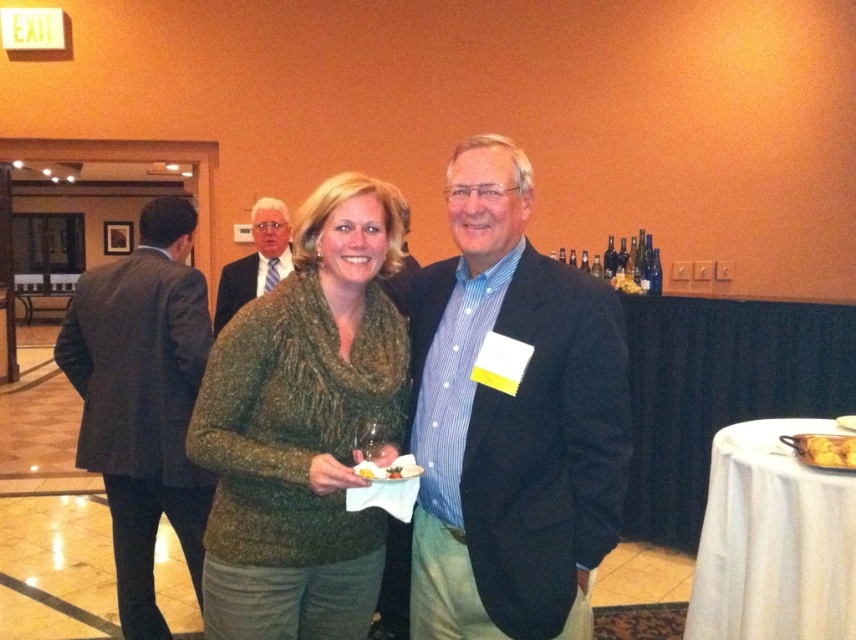
Which is in front, point (140, 230) or point (805, 456)?

Point (805, 456) is more forward.

Where is `dark gray suit at left`? This screenshot has height=640, width=856. dark gray suit at left is located at coordinates (141, 401).

Between green textured sweater at center and yellow matte plate at center, which one has more height?

With more height is green textured sweater at center.

Looking at this image, does green textured sweater at center appear on the left side of yellow matte plate at center?

In fact, green textured sweater at center is to the right of yellow matte plate at center.

Is point (477, 548) more distant than point (409, 454)?

No, (477, 548) is closer to viewer.

I want to click on green textured sweater at center, so (x=507, y=420).

Between point (485, 308) and point (545, 582), which one is positioned in front?

Point (545, 582)

In order to click on green textured sweater at center in this screenshot , I will do click(507, 420).